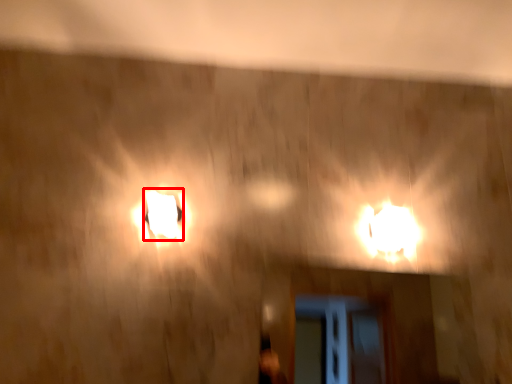
Question: In this image, where is lamp (annotated by the red box) located relative to lamp?

Choices:
 (A) left
 (B) right

Answer: (A)